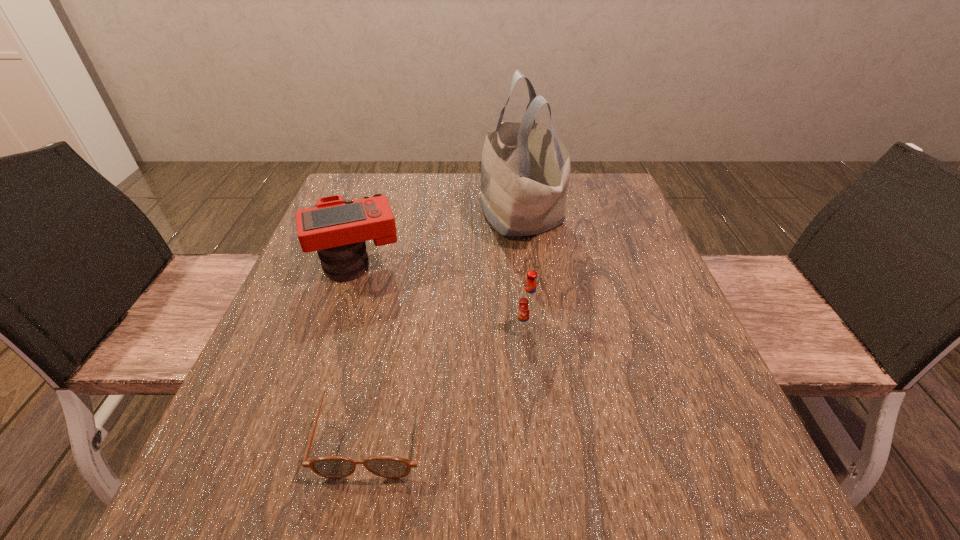
This screenshot has width=960, height=540. I want to click on object that stands as the closest to the camera, so click(x=525, y=170).

Locate an element on the screen. Image resolution: width=960 pixels, height=540 pixels. object that ranks as the closest to the camera is located at coordinates (525, 170).